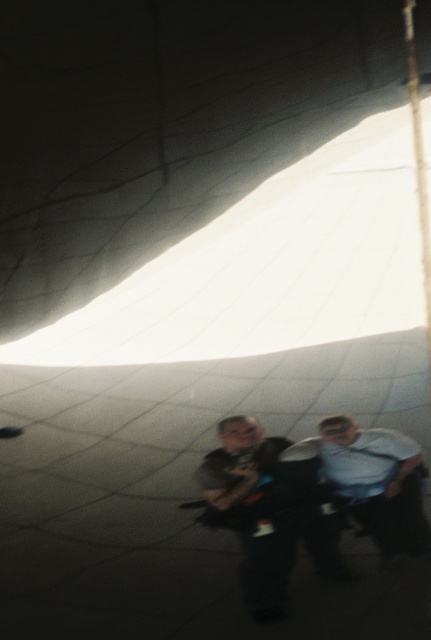
You are a photographer trying to capture the exact location of the matte black backpack at center in the image. What coordinates should you note down for future reference?

The coordinates for the matte black backpack at center are point (265, 515).

You are a photographer trying to capture a clear image of the light blue shirt at center while inside the moving structure. Since the matte black backpack at center is blocking your view, can you move around it to get an unobstructed shot?

The matte black backpack at center is in front of light blue shirt at center, so moving around it might allow you to get an unobstructed view of the light blue shirt at center.

You are planning to place a new item in the center of the inflated structure. Considering the existing items, which one has a greater width between the matte black backpack at center and the light blue shirt at center?

The matte black backpack at center has a greater width than the light blue shirt at center.